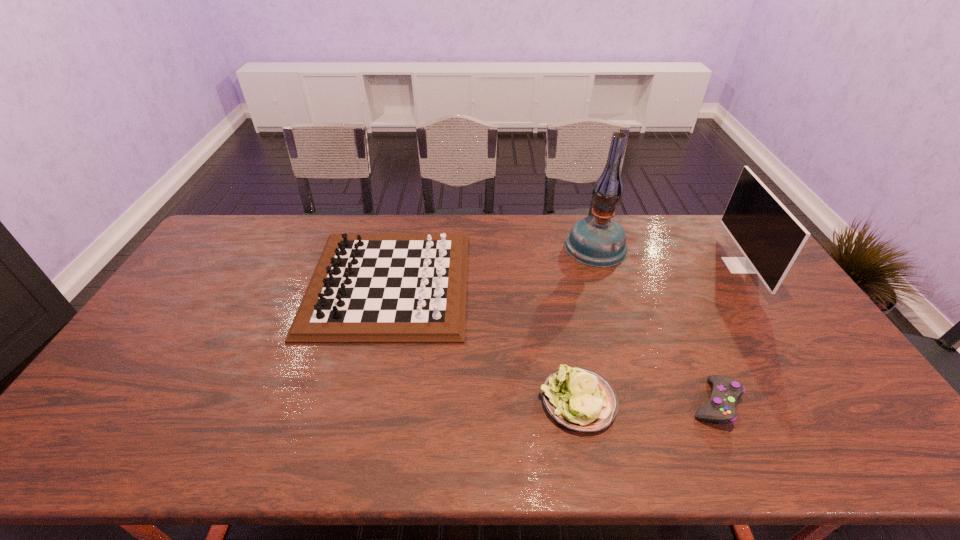
Where is `oil lamp`? oil lamp is located at coordinates (598, 241).

Where is `the rightmost object`? the rightmost object is located at coordinates (769, 236).

Find the location of a particular element. The height and width of the screenshot is (540, 960). monitor is located at coordinates (769, 236).

You are a GUI agent. You are given a task and a screenshot of the screen. Output one action in this format:
    pyautogui.click(x=<x>, y=<y>)
    Task: Click on the leftmost object
    
    Given the screenshot: What is the action you would take?
    pyautogui.click(x=368, y=288)

Locate an element on the screen. the third tallest object is located at coordinates (368, 288).

Where is `lettuce`? This screenshot has width=960, height=540. lettuce is located at coordinates [x=578, y=398].

This screenshot has width=960, height=540. In order to click on the shortest object in this screenshot , I will do `click(726, 391)`.

You are a GUI agent. You are given a task and a screenshot of the screen. Output one action in this format:
    pyautogui.click(x=<x>, y=<y>)
    Task: Click on the free region located 0.330m on the left of the tallest object
    The height and width of the screenshot is (540, 960).
    Given the screenshot: What is the action you would take?
    pyautogui.click(x=472, y=246)

This screenshot has width=960, height=540. What are the coordinates of `free region located on the front-facing side of the fourth shortest object` in the screenshot? It's located at (659, 266).

This screenshot has width=960, height=540. Find the location of `free space located 0.170m on the front-facing side of the fourth shortest object`. free space located 0.170m on the front-facing side of the fourth shortest object is located at coordinates (676, 266).